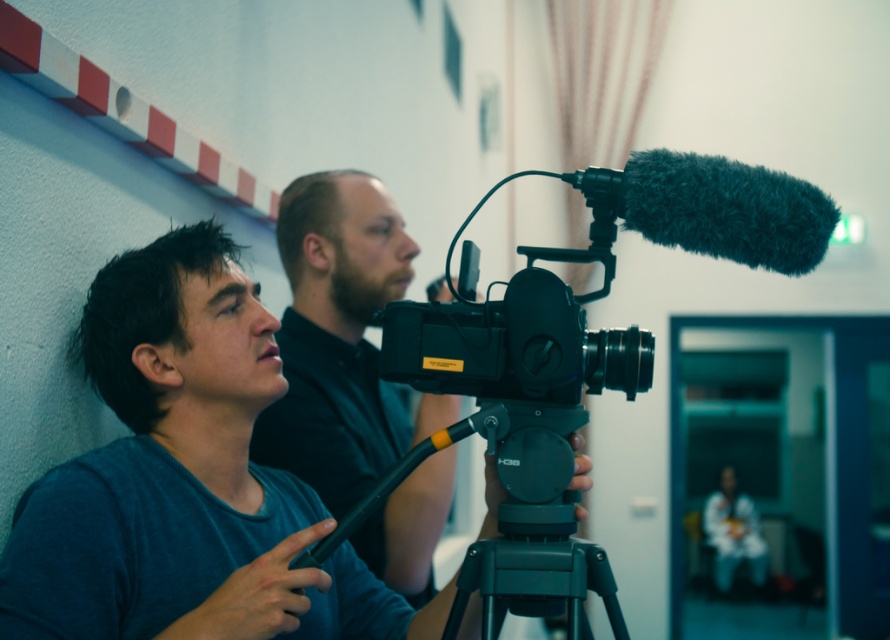
Question: Is matte black camera at center below black plastic tripod at center?

Choices:
 (A) yes
 (B) no

Answer: (A)

Question: Which point is closer to the camera?

Choices:
 (A) (555, 481)
 (B) (198, 460)
 (C) (727, 470)
 (D) (584, 624)

Answer: (D)

Question: Where is black matte video camera at center located in relation to white fabric at lower right in the image?

Choices:
 (A) below
 (B) above

Answer: (B)

Question: Which is farther from the white fabric at lower right?

Choices:
 (A) black plastic tripod at center
 (B) black matte video camera at center

Answer: (B)

Question: Which object appears closest to the camera in this image?

Choices:
 (A) black matte video camera at center
 (B) black plastic tripod at center
 (C) matte black camera at center

Answer: (A)

Question: Is matte black camera at center further to the viewer compared to black plastic tripod at center?

Choices:
 (A) yes
 (B) no

Answer: (B)